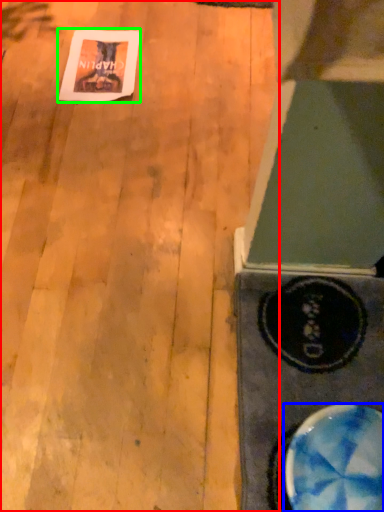
Question: Estimate the real-world distances between objects in this image. Which object is closer to plywood (highlighted by a red box), bowl (highlighted by a blue box) or postcard (highlighted by a green box)?

Choices:
 (A) bowl
 (B) postcard

Answer: (B)